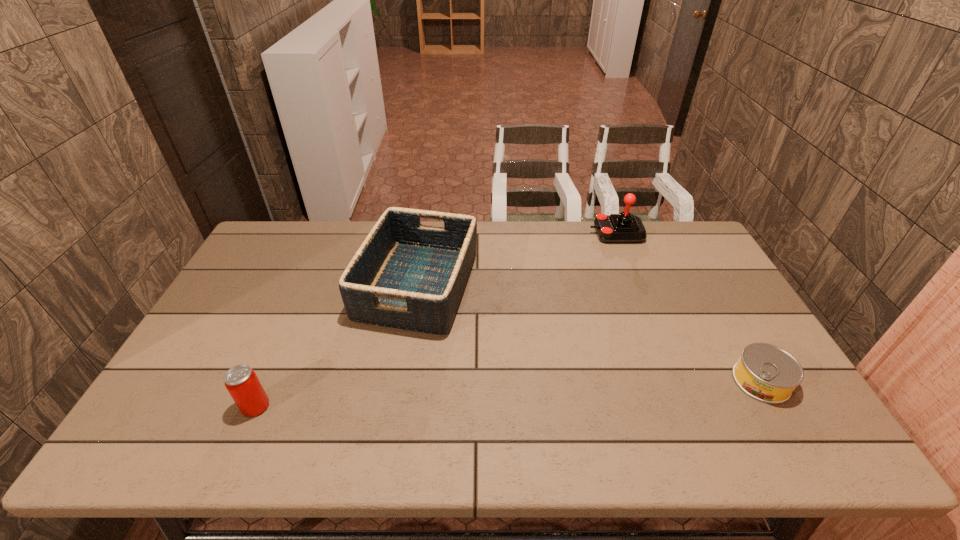
I want to click on the second object from right to left, so (615, 228).

Where is `basket`? Image resolution: width=960 pixels, height=540 pixels. basket is located at coordinates (405, 275).

Identify the location of the leftmost object. (241, 381).

Where is `the taller can`? the taller can is located at coordinates (241, 381).

Locate an element on the screen. This screenshot has width=960, height=540. the right can is located at coordinates (767, 373).

Locate an element on the screen. The height and width of the screenshot is (540, 960). the shortest object is located at coordinates (767, 373).

Locate an element on the screen. The image size is (960, 540). free point located on the base of the joystick is located at coordinates (529, 233).

Image resolution: width=960 pixels, height=540 pixels. I want to click on free space located 0.310m on the base of the joystick, so click(504, 233).

Locate an element on the screen. The height and width of the screenshot is (540, 960). free spot located 0.080m on the base of the joystick is located at coordinates (567, 233).

At what (x,y) coordinates should I click in order to perform the action: click on vacant space located on the right of the second object from left to right. Please return your answer as a coordinate pair (x, y). This screenshot has height=540, width=960. Looking at the image, I should click on (604, 285).